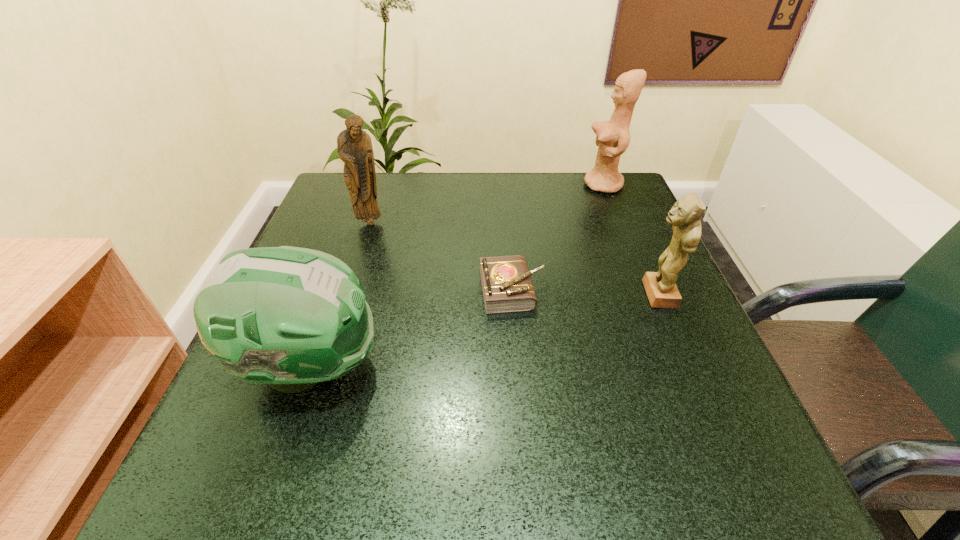
Find the location of a particular element. vacant space that satisfies the following two spatial constraints: 1. on the front-facing side of the farthest object; 2. on the front-facing side of the fourth nearest object is located at coordinates (618, 222).